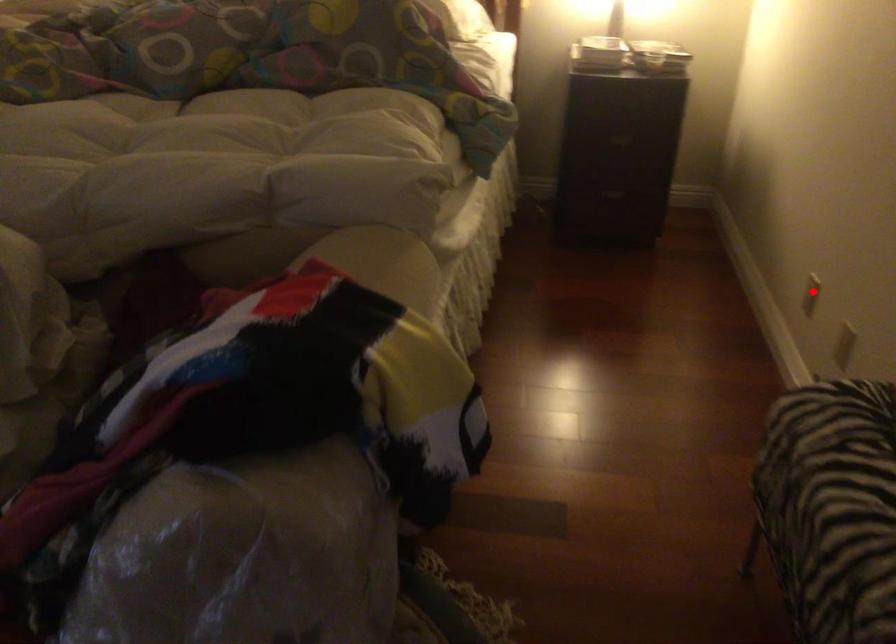
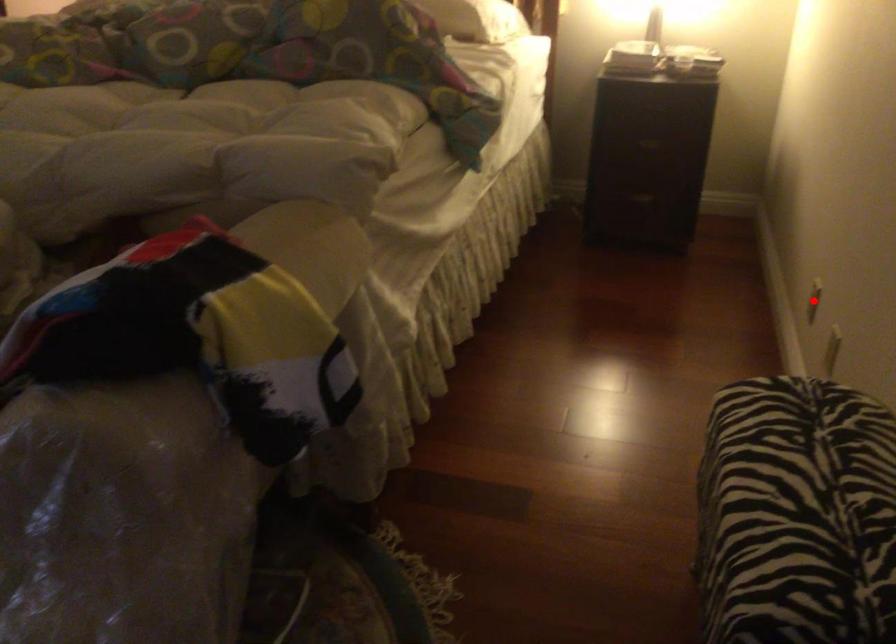
I am providing you with two images of the same scene from different viewpoints. A red point is marked on the first image and another point is marked on the second image. Is the marked point in image1 the same physical position as the marked point in image2?

Yes